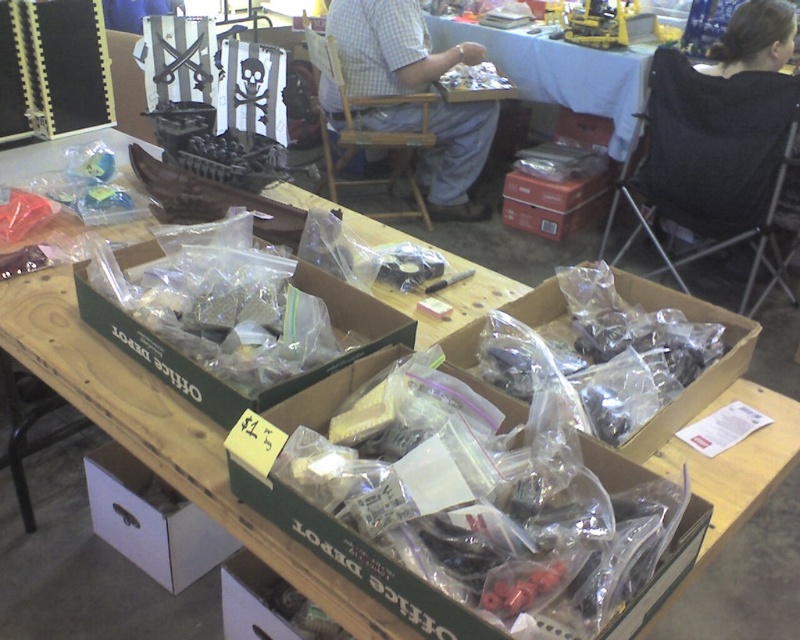
In the scene shown: You are a customer at the flea market and want to examine the translucent plastic parts at center closely. If you walk forward 1 meter, will you be able to touch them?

The translucent plastic parts at center are 95.11 centimeters away from the camera. If you walk forward 1 meter, you will be 4.89 centimeters beyond the parts, so you can reach them.

You are a customer at the flea market looking for a clear plastic box at center. According to the coordinates provided, where should you look on the table?

The clear plastic box at center is located at point coordinates at point (218,380).

You are standing at the point marked as point (128,353) in the image. You need to reach the other point which is 4.05 feet away. What is the minimum distance you must walk to get there?

The minimum distance you must walk is 4.05 feet to reach the other point from point (128,353).